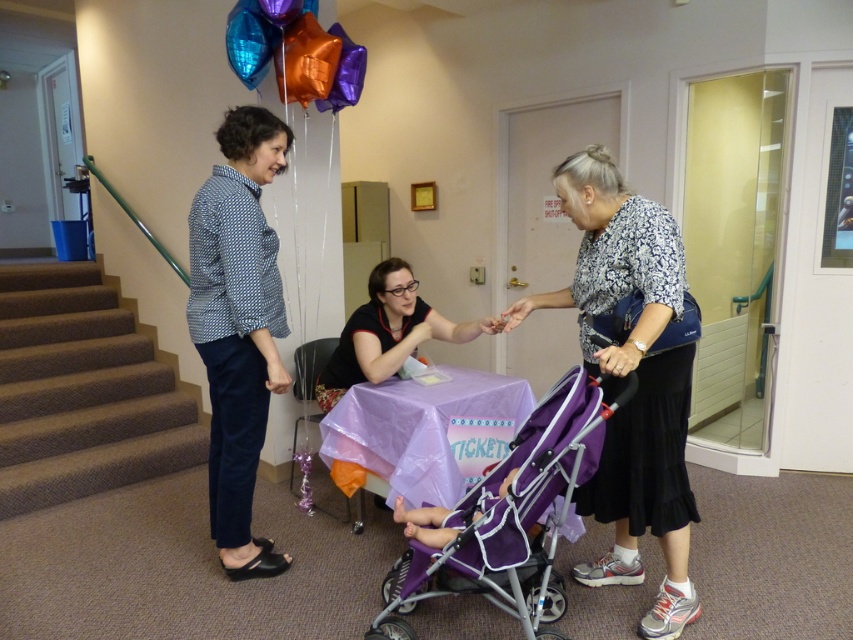
You are a photographer trying to capture a closeup of the shiny metallic balloon at upper center without including the matte black shirt at center in the frame. Is it possible to do so?

The matte black shirt at center might be wider than the shiny metallic balloon at upper center, so there is a possibility that the shirt could block the balloon if they are positioned in a way that the shirt is closer to the camera. However, without precise measurements of their positions and distances, it is uncertain if the balloon can be framed without the shirt.